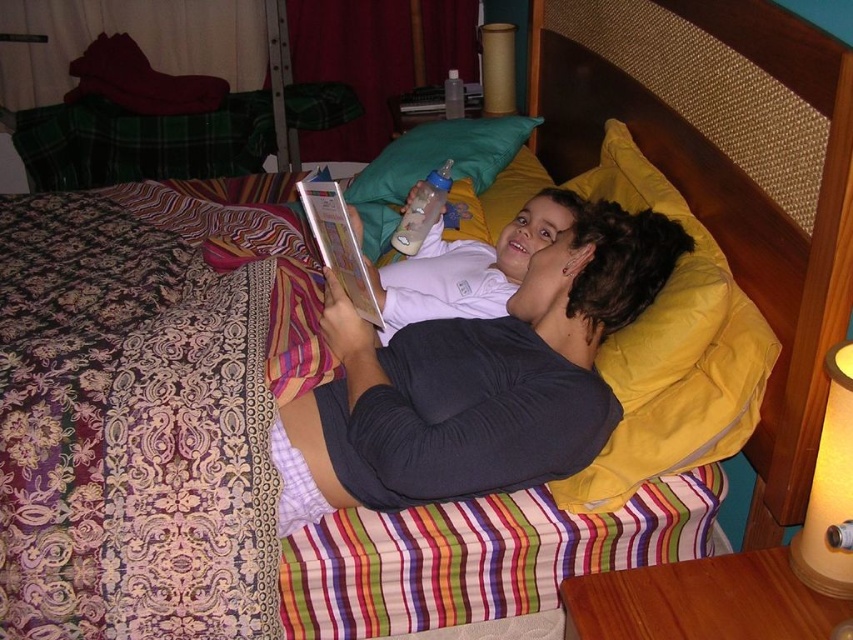
Question: Which point is farther to the camera?

Choices:
 (A) yellow fabric lampshade at right
 (B) hardcover book at center
 (C) green fabric pillow at upper center
 (D) matte brown cylinder at upper center

Answer: (D)

Question: In this image, where is yellow fabric pillow at upper right located relative to green fabric pillow at upper center?

Choices:
 (A) below
 (B) above

Answer: (A)

Question: Does yellow fabric pillow at upper right have a greater width compared to yellow fabric lampshade at right?

Choices:
 (A) no
 (B) yes

Answer: (B)

Question: Which object appears farthest from the camera in this image?

Choices:
 (A) yellow fabric pillow at upper right
 (B) yellow fabric lampshade at right
 (C) hardcover book at center
 (D) matte brown cylinder at upper center

Answer: (D)

Question: Which of the following is the farthest from the observer?

Choices:
 (A) yellow fabric lampshade at right
 (B) dark gray sweater at center
 (C) hardcover book at center
 (D) green fabric pillow at upper center

Answer: (D)

Question: Can you confirm if yellow fabric lampshade at right is smaller than matte brown cylinder at upper center?

Choices:
 (A) yes
 (B) no

Answer: (A)